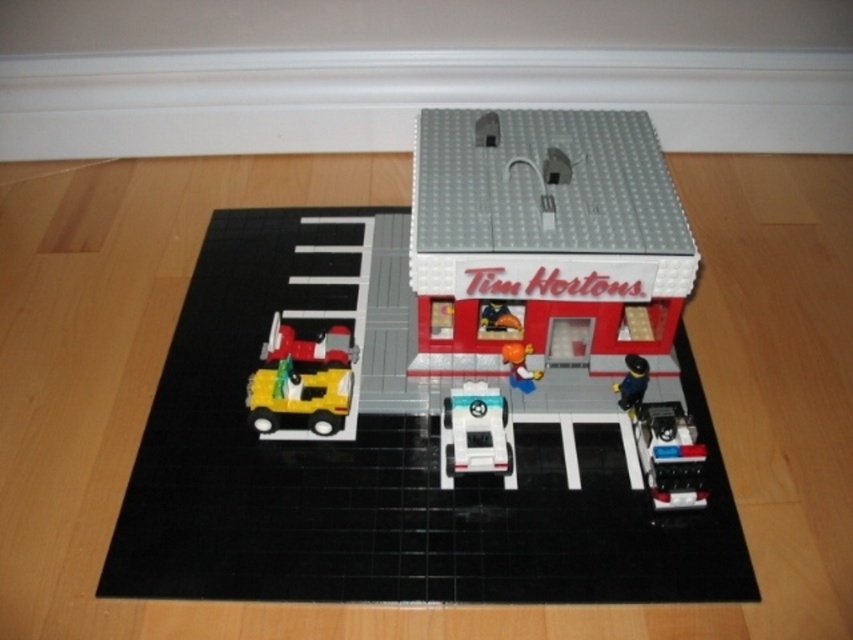
Which is behind, point (628, 378) or point (531, 392)?

Point (531, 392)

How distant is black plastic figure at lower right from orange matte figure at center?

A distance of 5.76 inches exists between black plastic figure at lower right and orange matte figure at center.

Which is behind, point (634, 388) or point (514, 381)?

The point (514, 381) is behind.

Where is `black plastic figure at lower right`? black plastic figure at lower right is located at coordinates (631, 384).

Is point (636, 502) farther from viewer compared to point (320, 420)?

No, it is not.

Is black rubber mat at center positioned before shiny yellow truck at lower left?

Yes, it is in front of shiny yellow truck at lower left.

The width and height of the screenshot is (853, 640). I want to click on black rubber mat at center, so click(x=379, y=477).

The width and height of the screenshot is (853, 640). Identify the location of black rubber mat at center. (379, 477).

Who is positioned more to the left, smooth plastic tim hortons building at center or shiny red car at center?

shiny red car at center

Who is taller, smooth plastic tim hortons building at center or shiny red car at center?

smooth plastic tim hortons building at center is taller.

Who is more forward, (688, 260) or (326, 333)?

Point (688, 260)

Locate an element on the screen. The image size is (853, 640). smooth plastic tim hortons building at center is located at coordinates (546, 225).